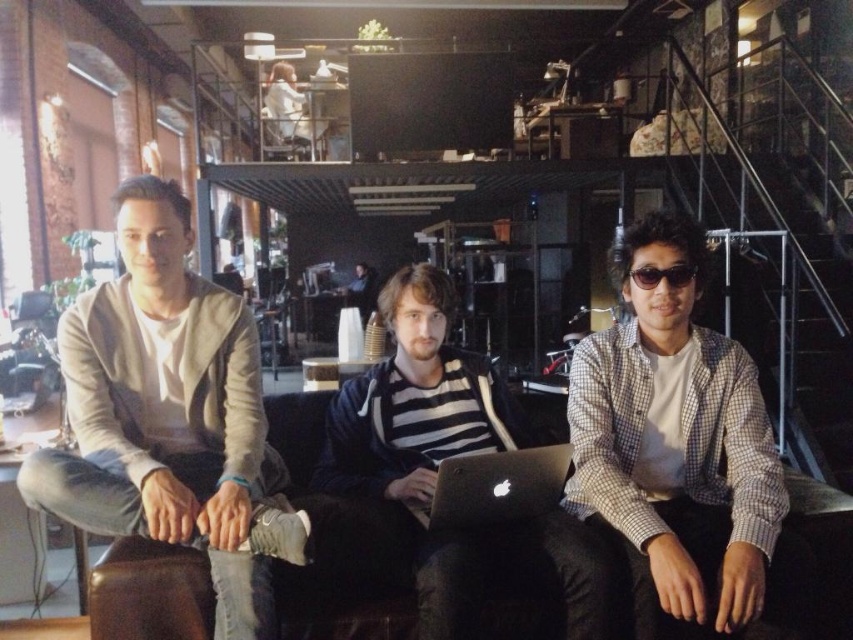
Question: Does black matte laptop at center have a smaller size compared to black plastic sunglasses at center?

Choices:
 (A) no
 (B) yes

Answer: (A)

Question: Which of these objects is positioned farthest from the striped fabric shirt at center?

Choices:
 (A) black matte laptop at center
 (B) silver metallic laptop at center

Answer: (B)

Question: Which object is closer to the camera taking this photo?

Choices:
 (A) silver metallic laptop at center
 (B) striped fabric shirt at center

Answer: (A)

Question: Can you confirm if black matte laptop at center is bigger than brown leather couch at center?

Choices:
 (A) no
 (B) yes

Answer: (B)

Question: Which object is positioned farthest from the silver metallic laptop at center?

Choices:
 (A) light beige sweater at center
 (B) black matte laptop at center
 (C) striped fabric shirt at center
 (D) brown leather couch at center

Answer: (C)

Question: Does black matte laptop at center have a smaller size compared to striped fabric shirt at center?

Choices:
 (A) yes
 (B) no

Answer: (A)